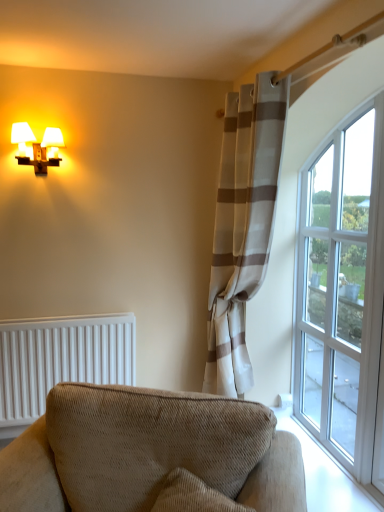
I want to click on clear glass window at right, so click(341, 288).

Identify the location of beige striped curtain at right. The width and height of the screenshot is (384, 512). (243, 226).

This screenshot has height=512, width=384. What do you see at coordinates (243, 226) in the screenshot?
I see `beige striped curtain at right` at bounding box center [243, 226].

In order to click on white textured radiator at lower left in this screenshot , I will do `click(60, 360)`.

The image size is (384, 512). What are the coordinates of `matte white sconce at upper left` in the screenshot? It's located at (37, 147).

Is point (115, 336) closer or farther from the camera than point (73, 506)?

Point (115, 336) appears to be farther away from the viewer than point (73, 506).

Is white textured radiator at lower left touching beige corduroy couch at lower center?

No, white textured radiator at lower left is not next to beige corduroy couch at lower center.

From the image's perspective, between white textured radiator at lower left and beige corduroy couch at lower center, who is located below?

beige corduroy couch at lower center is shown below in the image.

From the picture: Is beige striped curtain at right surrounded by beige corduroy couch at lower center?

Actually, beige striped curtain at right is outside beige corduroy couch at lower center.

The image size is (384, 512). Find the location of `curtain above the beige corduroy couch at lower center (from a real-world perspective)`. curtain above the beige corduroy couch at lower center (from a real-world perspective) is located at coordinates (243, 226).

From the image's perspective, is beige corduroy couch at lower center above beige striped curtain at right?

No.

Which is in front, beige corduroy couch at lower center or beige striped curtain at right?

Answer: beige corduroy couch at lower center is in front.

Is white textured radiator at lower left to the left or to the right of matte white sconce at upper left in the image?

white textured radiator at lower left is positioned on matte white sconce at upper left's right side.

From a real-world perspective, between white textured radiator at lower left and matte white sconce at upper left, who is vertically higher?

matte white sconce at upper left is physically above.

From a real-world perspective, which object stands above the other?

clear glass window at right is physically above.

From the image's perspective, is clear glass window at right above white textured radiator at lower left?

Yes, from the image's perspective, clear glass window at right is over white textured radiator at lower left.

Considering the relative positions of clear glass window at right and white textured radiator at lower left in the image provided, is clear glass window at right in front of white textured radiator at lower left?

Yes, clear glass window at right is closer to the viewer.

Is point (172, 395) in front of point (14, 125)?

Yes, it is in front of point (14, 125).

Could you tell me if beige corduroy couch at lower center is facing matte white sconce at upper left?

No, beige corduroy couch at lower center is not turned towards matte white sconce at upper left.

How many degrees apart are the facing directions of beige corduroy couch at lower center and matte white sconce at upper left?

26.8 degrees separate the facing orientations of beige corduroy couch at lower center and matte white sconce at upper left.

Which is correct: beige corduroy couch at lower center is inside matte white sconce at upper left, or outside of it?

beige corduroy couch at lower center is not inside matte white sconce at upper left, it's outside.

From the image's perspective, relative to beige striped curtain at right, is white textured radiator at lower left above or below?

white textured radiator at lower left is below beige striped curtain at right.

Can you confirm if white textured radiator at lower left is wider than beige striped curtain at right?

No, white textured radiator at lower left is not wider than beige striped curtain at right.

From a real-world perspective, is white textured radiator at lower left positioned above or below beige striped curtain at right?

Clearly, from a real-world perspective, white textured radiator at lower left is below beige striped curtain at right.

At what (x,y) coordinates should I click in order to perform the action: click on window behind the beige corduroy couch at lower center. Please return your answer as a coordinate pair (x, y). Looking at the image, I should click on (341, 288).

What's the angular difference between clear glass window at right and beige corduroy couch at lower center's facing directions?

They differ by 63.7 degrees in their facing directions.

Does clear glass window at right turn towards beige corduroy couch at lower center?

No, clear glass window at right does not turn towards beige corduroy couch at lower center.

Based on the photo, from a real-world perspective, which is physically above, clear glass window at right or beige corduroy couch at lower center?

clear glass window at right, from a real-world perspective.

Image resolution: width=384 pixels, height=512 pixels. In order to click on studio couch on the right of white textured radiator at lower left in this screenshot , I will do `click(147, 451)`.

At what (x,y) coordinates should I click in order to perform the action: click on studio couch that is on the left side of beige striped curtain at right. Please return your answer as a coordinate pair (x, y). Looking at the image, I should click on (147, 451).

Based on their spatial positions, is clear glass window at right or white textured radiator at lower left closer to beige corduroy couch at lower center?

Based on the image, white textured radiator at lower left appears to be nearer to beige corduroy couch at lower center.

Looking at the image, which one is located closer to beige corduroy couch at lower center, white textured radiator at lower left or beige striped curtain at right?

Among the two, white textured radiator at lower left is located nearer to beige corduroy couch at lower center.

Which object lies nearer to the anchor point white textured radiator at lower left, matte white sconce at upper left or clear glass window at right?

matte white sconce at upper left lies closer to white textured radiator at lower left than the other object.

Looking at the image, which one is located closer to matte white sconce at upper left, beige corduroy couch at lower center or beige striped curtain at right?

beige striped curtain at right.

When comparing their distances from clear glass window at right, does beige striped curtain at right or matte white sconce at upper left seem closer?

Based on the image, beige striped curtain at right appears to be nearer to clear glass window at right.

Considering their positions, is clear glass window at right positioned closer to white textured radiator at lower left than beige corduroy couch at lower center?

The object closer to white textured radiator at lower left is beige corduroy couch at lower center.

When comparing their distances from beige striped curtain at right, does beige corduroy couch at lower center or white textured radiator at lower left seem closer?

Among the two, white textured radiator at lower left is located nearer to beige striped curtain at right.

From the image, which object appears to be farther from clear glass window at right, white textured radiator at lower left or matte white sconce at upper left?

The object further to clear glass window at right is matte white sconce at upper left.

You are a GUI agent. You are given a task and a screenshot of the screen. Output one action in this format:
    pyautogui.click(x=<x>, y=<y>)
    Task: Click on the curtain between beige corduroy couch at lower center and clear glass window at right along the z-axis
    This screenshot has height=512, width=384.
    Given the screenshot: What is the action you would take?
    pyautogui.click(x=243, y=226)

At what (x,y) coordinates should I click in order to perform the action: click on studio couch between matte white sconce at upper left and clear glass window at right. Please return your answer as a coordinate pair (x, y). The width and height of the screenshot is (384, 512). Looking at the image, I should click on (147, 451).

This screenshot has height=512, width=384. I want to click on curtain between white textured radiator at lower left and clear glass window at right in the horizontal direction, so click(x=243, y=226).

Identify the location of curtain positioned between beige corduroy couch at lower center and matte white sconce at upper left from near to far. Image resolution: width=384 pixels, height=512 pixels. (243, 226).